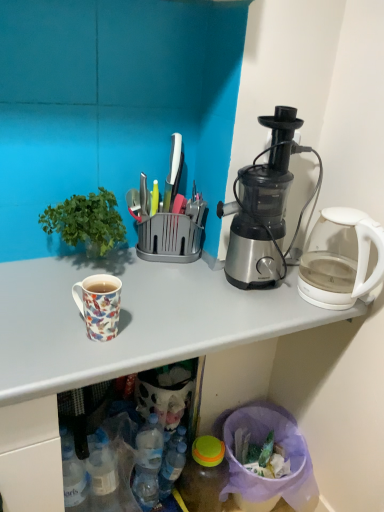
Question: Considering the positions of point (271, 236) and point (180, 435), is point (271, 236) closer or farther from the camera than point (180, 435)?

Choices:
 (A) farther
 (B) closer

Answer: (B)

Question: Based on their positions, is satin silver blender at right located to the left or right of translucent plastic bottle at lower center, acting as the second bottle starting from the right?

Choices:
 (A) left
 (B) right

Answer: (B)

Question: Which is farther from the floral ceramic mug at left?

Choices:
 (A) green leafy plant at left
 (B) translucent plastic bottle at lower center, the first bottle positioned from the left
 (C) transparent glass kettle at right
 (D) white glossy mug at upper left
 (E) translucent plastic bottle at lower center, the first bottle in the right-to-left sequence

Answer: (E)

Question: Based on their relative distances, which object is farther from the translucent plastic bottle at lower center, the first bottle in the right-to-left sequence?

Choices:
 (A) floral ceramic mug at left
 (B) green leafy plant at left
 (C) white glossy mug at upper left
 (D) satin silver blender at right
 (E) translucent plastic bottle at lower center, the first bottle positioned from the left

Answer: (B)